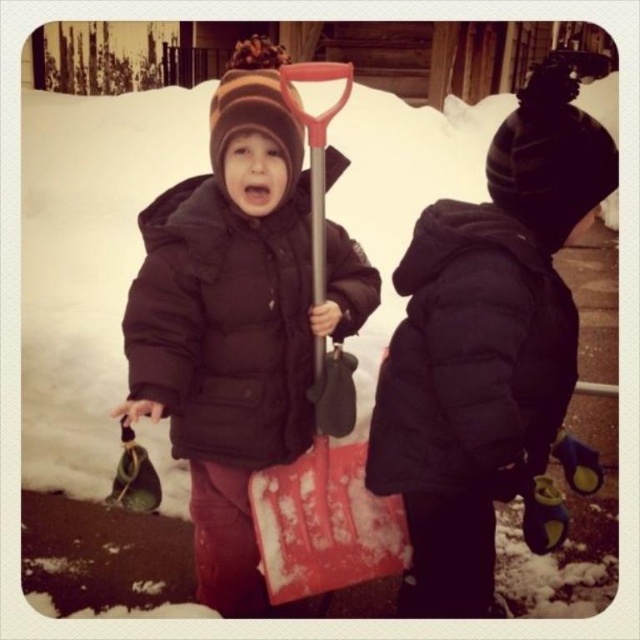
Question: Which point is farther to the camera?

Choices:
 (A) black matte jacket at center
 (B) matte black jacket at center
 (C) red plastic shovel at center

Answer: (C)

Question: Is black matte jacket at center to the right of red plastic shovel at center from the viewer's perspective?

Choices:
 (A) no
 (B) yes

Answer: (B)

Question: Is black matte jacket at center smaller than red plastic shovel at center?

Choices:
 (A) yes
 (B) no

Answer: (B)

Question: Which point appears farthest from the camera in this image?

Choices:
 (A) (509, 118)
 (B) (323, 156)
 (C) (225, 570)

Answer: (C)

Question: Which object is the closest to the black matte jacket at center?

Choices:
 (A) red plastic shovel at center
 (B) matte black jacket at center

Answer: (A)

Question: From the image, what is the correct spatial relationship of black matte jacket at center in relation to matte black jacket at center?

Choices:
 (A) above
 (B) below

Answer: (A)